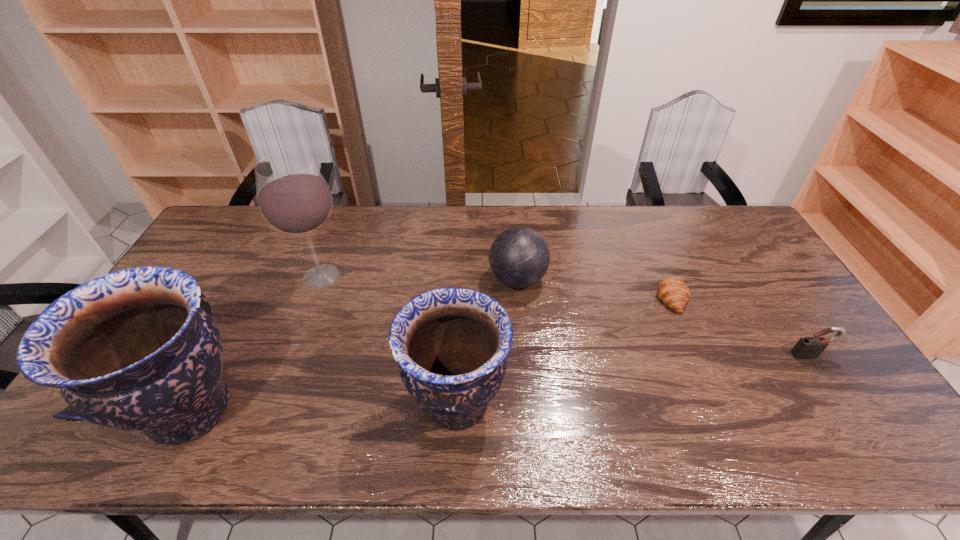
The height and width of the screenshot is (540, 960). In the image, there is a desktop. Identify the location of free region at the far edge. (666, 209).

In order to click on free location at the near edge of the desktop in this screenshot , I will do `click(667, 396)`.

What are the coordinates of `vacant space at the left edge of the desktop` in the screenshot? It's located at (x=205, y=283).

The width and height of the screenshot is (960, 540). In order to click on vacant space at the far right corner of the desktop in this screenshot , I will do `click(692, 208)`.

The width and height of the screenshot is (960, 540). What are the coordinates of `vacant space in between the fourth tallest object and the padlock` in the screenshot? It's located at (663, 317).

This screenshot has height=540, width=960. Identify the location of free spot between the shorter pottery and the second shortest object. (633, 379).

In order to click on free area in between the rightmost object and the tallest object in this screenshot , I will do `click(565, 316)`.

Locate an element on the screen. The height and width of the screenshot is (540, 960). unoccupied area between the fourth tallest object and the fifth shortest object is located at coordinates (354, 345).

You are a GUI agent. You are given a task and a screenshot of the screen. Output one action in this format:
    pyautogui.click(x=<x>, y=<y>)
    Task: Click on the vacant space that's between the left pottery and the alcohol
    The height and width of the screenshot is (540, 960).
    Given the screenshot: What is the action you would take?
    pyautogui.click(x=256, y=343)

Where is `vacant point located between the tallest object and the crescent roll`? This screenshot has height=540, width=960. vacant point located between the tallest object and the crescent roll is located at coordinates (496, 287).